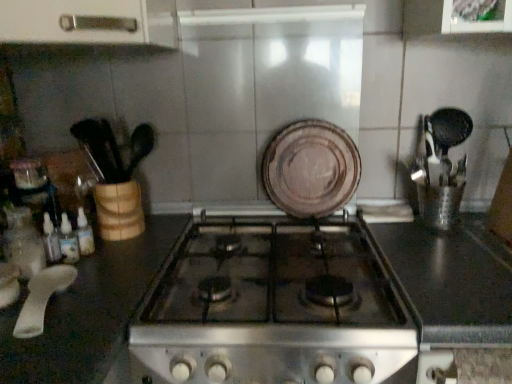
Question: From the image's perspective, is brown matte plate at center under black glass stove at center?

Choices:
 (A) no
 (B) yes

Answer: (A)

Question: Is brown matte plate at center bigger than black glass stove at center?

Choices:
 (A) no
 (B) yes

Answer: (A)

Question: Is the position of brown matte plate at center less distant than that of black glass stove at center?

Choices:
 (A) no
 (B) yes

Answer: (A)

Question: From a real-world perspective, is brown matte plate at center over black glass stove at center?

Choices:
 (A) no
 (B) yes

Answer: (B)

Question: Can you confirm if brown matte plate at center is smaller than black glass stove at center?

Choices:
 (A) no
 (B) yes

Answer: (B)

Question: From the image's perspective, is brown matte plate at center on black glass stove at center?

Choices:
 (A) no
 (B) yes

Answer: (B)

Question: Is white plastic spoon at lower left in front of brown matte plate at center?

Choices:
 (A) no
 (B) yes

Answer: (B)

Question: Can brown matte plate at center be found inside white plastic spoon at lower left?

Choices:
 (A) yes
 (B) no

Answer: (B)

Question: From a real-world perspective, is white plastic spoon at lower left located higher than brown matte plate at center?

Choices:
 (A) no
 (B) yes

Answer: (A)

Question: Could you tell me if white plastic spoon at lower left is turned towards brown matte plate at center?

Choices:
 (A) no
 (B) yes

Answer: (A)

Question: Is white plastic spoon at lower left to the left of brown matte plate at center from the viewer's perspective?

Choices:
 (A) yes
 (B) no

Answer: (A)

Question: Is white plastic spoon at lower left thinner than brown matte plate at center?

Choices:
 (A) yes
 (B) no

Answer: (B)

Question: Could you tell me if white plastic spoon at lower left is facing black glass stove at center?

Choices:
 (A) yes
 (B) no

Answer: (A)